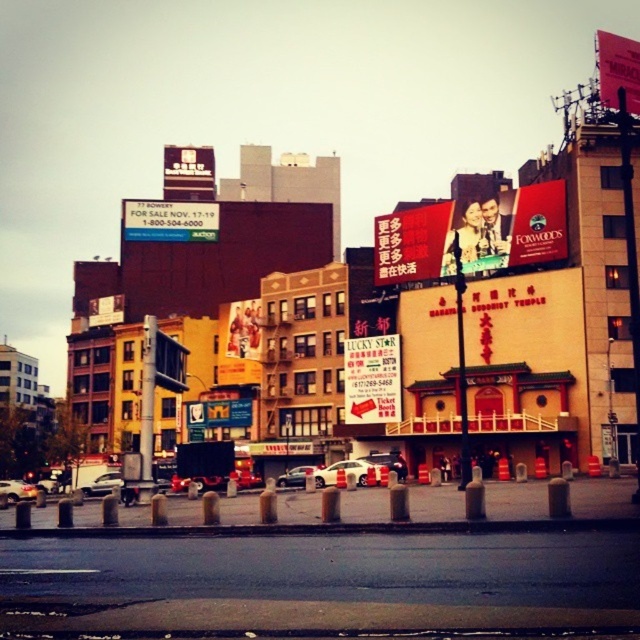
Based on the photo, is matte gold billboard at center bigger than white matte car at center?

Indeed, matte gold billboard at center has a larger size compared to white matte car at center.

Which of these two, matte gold billboard at center or white matte car at center, stands shorter?

With less height is white matte car at center.

Does point (246, 310) come closer to viewer compared to point (321, 484)?

No, (246, 310) is further to viewer.

Locate an element on the screen. matte gold billboard at center is located at coordinates (241, 330).

Does matte plastic billboard at center appear on the right side of metallic sign at upper center?

Correct, you'll find matte plastic billboard at center to the right of metallic sign at upper center.

What do you see at coordinates (477, 221) in the screenshot? The width and height of the screenshot is (640, 640). I see `matte plastic billboard at center` at bounding box center [477, 221].

What do you see at coordinates (477, 221) in the screenshot?
I see `matte plastic billboard at center` at bounding box center [477, 221].

You are a GUI agent. You are given a task and a screenshot of the screen. Output one action in this format:
    pyautogui.click(x=<x>, y=<y>)
    Task: Click on the matte plastic billboard at center
    This screenshot has width=640, height=640.
    Given the screenshot: What is the action you would take?
    pyautogui.click(x=477, y=221)

Can you confirm if blue glossy sign at upper left is thinner than metallic sign at upper center?

In fact, blue glossy sign at upper left might be wider than metallic sign at upper center.

Does point (188, 209) come in front of point (168, 154)?

Yes, it is.

Locate an element on the screen. The width and height of the screenshot is (640, 640). blue glossy sign at upper left is located at coordinates (170, 221).